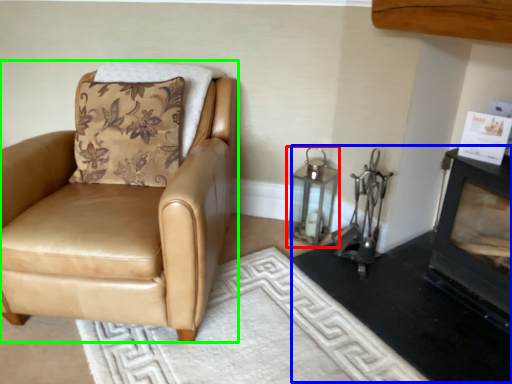
Question: Which object is positioned closest to lantern (highlighted by a red box)? Select from fireplace (highlighted by a blue box) and chair (highlighted by a green box).

Choices:
 (A) fireplace
 (B) chair

Answer: (A)